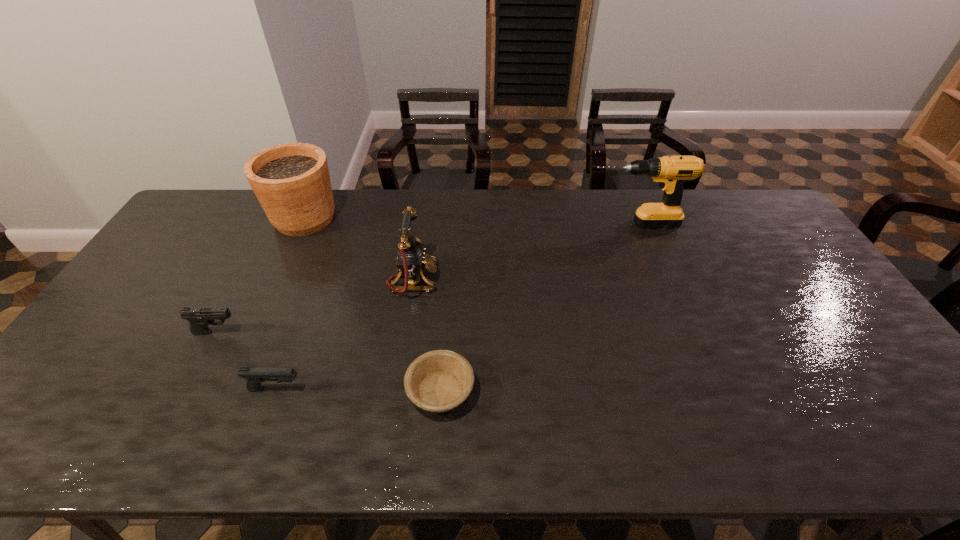
Find the location of a particular element. free space located on the right of the flowerpot is located at coordinates (369, 218).

At what (x,y) coordinates should I click in order to perform the action: click on vacant space located 0.380m on the front of the third farthest object, featuring the rotary dial. Please return your answer as a coordinate pair (x, y). The image size is (960, 540). Looking at the image, I should click on (563, 279).

The width and height of the screenshot is (960, 540). What are the coordinates of `free space located at the barrel of the third nearest object` in the screenshot? It's located at (381, 332).

What are the coordinates of `vacant space located 0.200m at the barrel of the nearer pistol` in the screenshot? It's located at (385, 389).

Locate an element on the screen. This screenshot has width=960, height=540. vacant space situated on the left of the shortest object is located at coordinates (311, 391).

Where is `drill at the far edge`? The image size is (960, 540). drill at the far edge is located at coordinates (671, 172).

Image resolution: width=960 pixels, height=540 pixels. Find the location of `flowerpot present at the far edge`. flowerpot present at the far edge is located at coordinates (291, 181).

The width and height of the screenshot is (960, 540). I want to click on object at the near edge, so coord(438,381).

At what (x,y) coordinates should I click in order to perform the action: click on free space at the far edge of the desktop. Please return your answer as a coordinate pair (x, y). Looking at the image, I should click on (660, 193).

What are the coordinates of `vacant area at the near edge` in the screenshot? It's located at (570, 420).